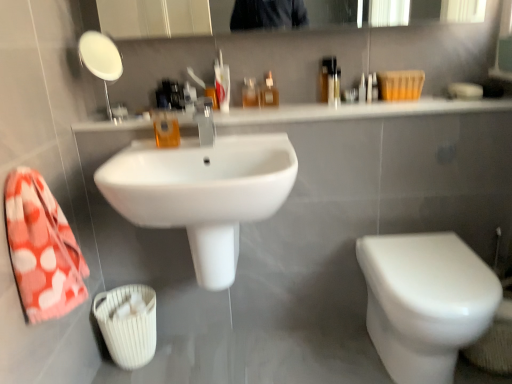
The width and height of the screenshot is (512, 384). Identify the location of free spot to the right of translucent plastic bottle at center, acting as the first mouthwash starting from the back. (298, 107).